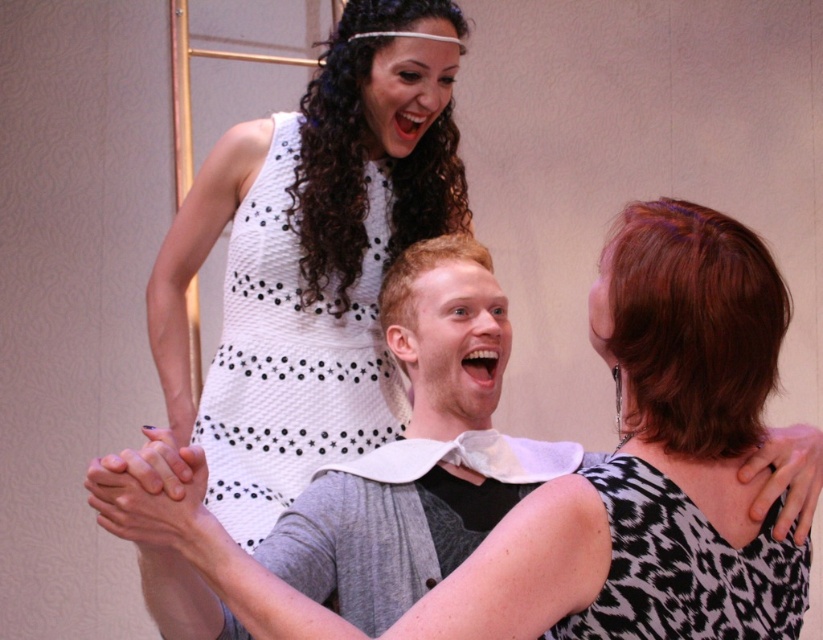
You are a photographer trying to capture a clear shot of the white dotted dress at upper center and the white dotted fabric dress at upper center. Which one is closer to the camera?

The white dotted dress at upper center is positioned under the white dotted fabric dress at upper center, so the white dotted fabric dress at upper center is closer to the camera.

You are standing in the room and want to hand a gift to the person wearing the white dotted fabric dress at upper center and the person wearing the black and white printed dress at upper right. Which person should you approach first to give the gift?

You should approach the person wearing the white dotted fabric dress at upper center first because they are closer to you than the black and white printed dress at upper right, which is further away.